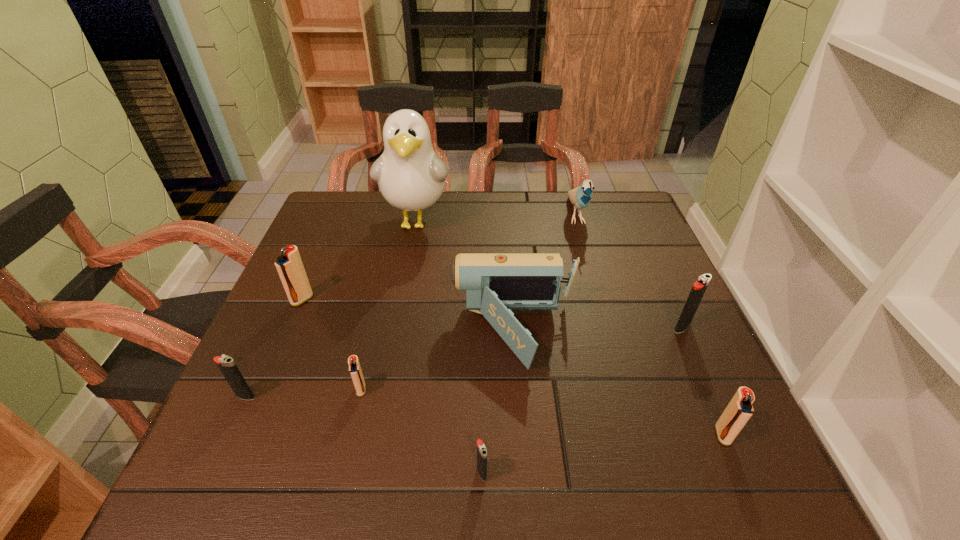
Image resolution: width=960 pixels, height=540 pixels. Find the location of `bird positioned at the right edge`. bird positioned at the right edge is located at coordinates (581, 196).

Where is `object positioned at the far right corner`? The height and width of the screenshot is (540, 960). object positioned at the far right corner is located at coordinates (581, 196).

What are the coordinates of `object positioned at the near right corner` in the screenshot? It's located at (739, 410).

Locate an element on the screen. vacant region at the far edge of the desktop is located at coordinates (445, 192).

The width and height of the screenshot is (960, 540). What are the coordinates of `vacant region at the near edge of the desktop` in the screenshot? It's located at (411, 489).

This screenshot has width=960, height=540. What are the coordinates of `vacant space at the left edge of the desktop` in the screenshot? It's located at (340, 320).

Identify the location of vacant area at the right edge. (624, 320).

In the image, there is a desktop. Identify the location of vacant space at the far left corner. (332, 224).

The image size is (960, 540). I want to click on free space at the far right corner, so click(632, 229).

Where is `vacant space at the near right corner of the desktop`? The width and height of the screenshot is (960, 540). vacant space at the near right corner of the desktop is located at coordinates (676, 445).